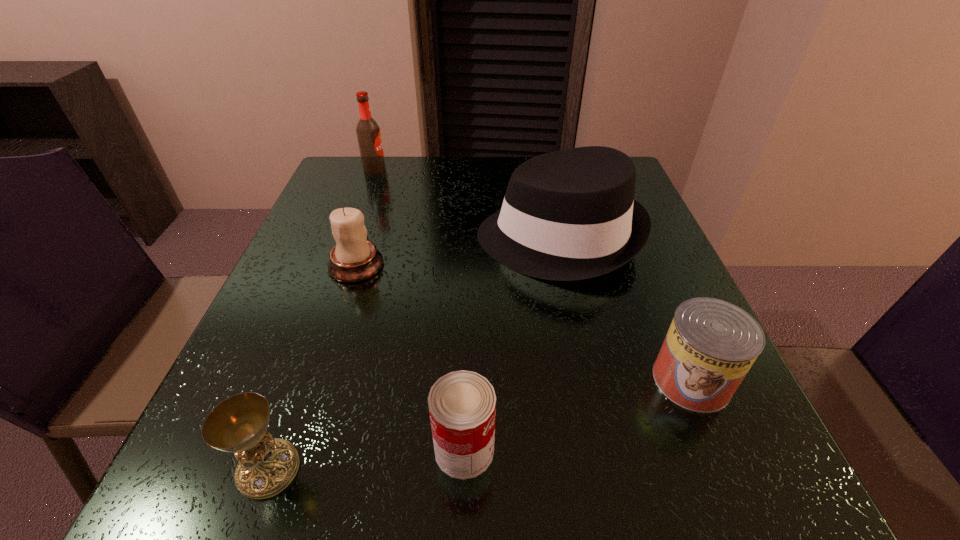
Image resolution: width=960 pixels, height=540 pixels. I want to click on free point between the fedora and the chalice, so click(x=414, y=354).

Locate which object ranks fourth in proximity to the fourth farthest object. Please provide its 2D coordinates. Your answer should be formatted as a tuple, i.e. [(x, y)], where the tuple contains the x and y coordinates of a point satisfying the conditions above.

[(267, 465)]

Image resolution: width=960 pixels, height=540 pixels. Identify the location of object that stands as the closest to the fedora. (711, 344).

Image resolution: width=960 pixels, height=540 pixels. I want to click on free spot that satisfies the following two spatial constraints: 1. on the front side of the third nearest object; 2. on the front label of the left can, so click(720, 449).